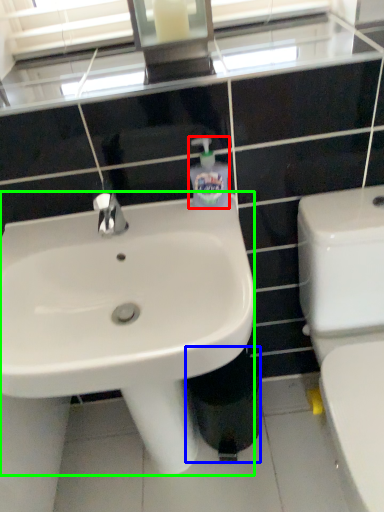
Question: Estimate the real-world distances between objects in this image. Which object is closer to toiletries (highlighted by a red box), trash bin/can (highlighted by a blue box) or sink (highlighted by a green box)?

Choices:
 (A) trash bin/can
 (B) sink

Answer: (B)